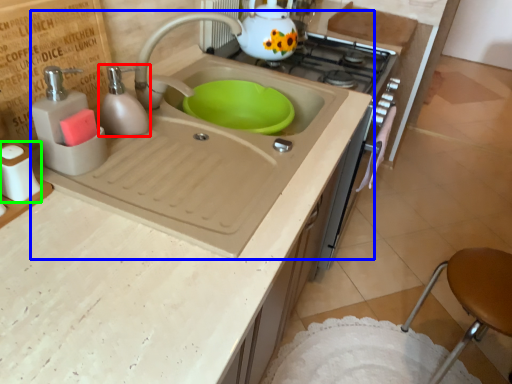
Question: Which is nearer to the soap dispenser (highlighted by a red box)? sink (highlighted by a blue box) or salt shaker (highlighted by a green box).

Choices:
 (A) sink
 (B) salt shaker

Answer: (A)